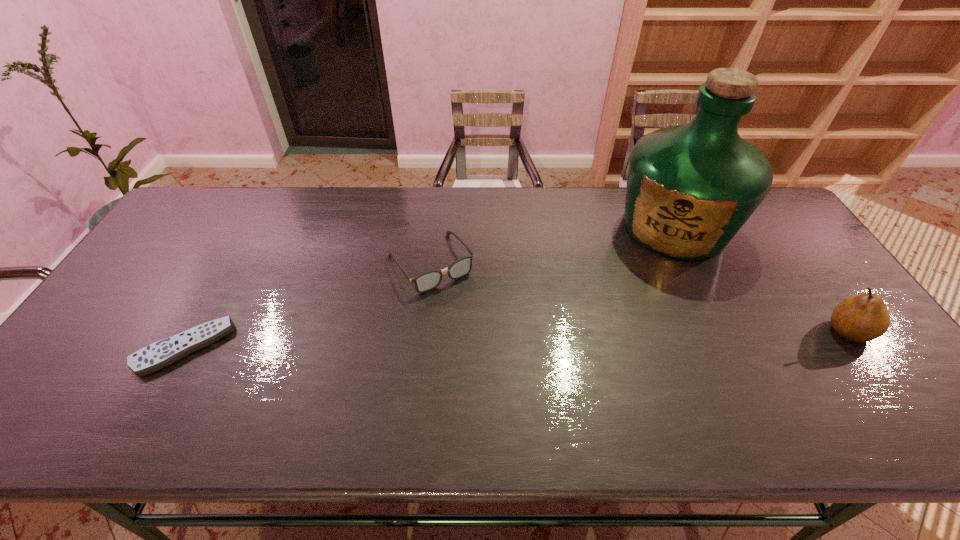
Identify the location of blank region between the pear and the leftmost object. This screenshot has width=960, height=540. (516, 339).

The image size is (960, 540). I want to click on free spot between the liquor and the rightmost object, so click(x=761, y=279).

Locate an element on the screen. Image resolution: width=960 pixels, height=540 pixels. vacant region between the remote control and the second object from left to right is located at coordinates (307, 305).

Locate an element on the screen. The width and height of the screenshot is (960, 540). empty location between the spectacles and the third shortest object is located at coordinates (639, 297).

This screenshot has height=540, width=960. Identify the location of empty location between the second object from right to left and the second tallest object. (761, 279).

Locate an element on the screen. the closest object to the rightmost object is located at coordinates (690, 188).

The image size is (960, 540). I want to click on object that stands as the third closest to the liquor, so click(162, 353).

Find the location of a particular element. The width and height of the screenshot is (960, 540). vacant area that satisfies the following two spatial constraints: 1. on the front side of the second tallest object; 2. on the right side of the spectacles is located at coordinates (423, 331).

Identify the location of vacant space that satisfies the following two spatial constraints: 1. on the front side of the rightmost object; 2. on the left side of the third object from left to right. (725, 331).

Find the location of a particular element. The width and height of the screenshot is (960, 540). free space that satisfies the following two spatial constraints: 1. on the back side of the third object from left to right; 2. on the right side of the remote control is located at coordinates (252, 227).